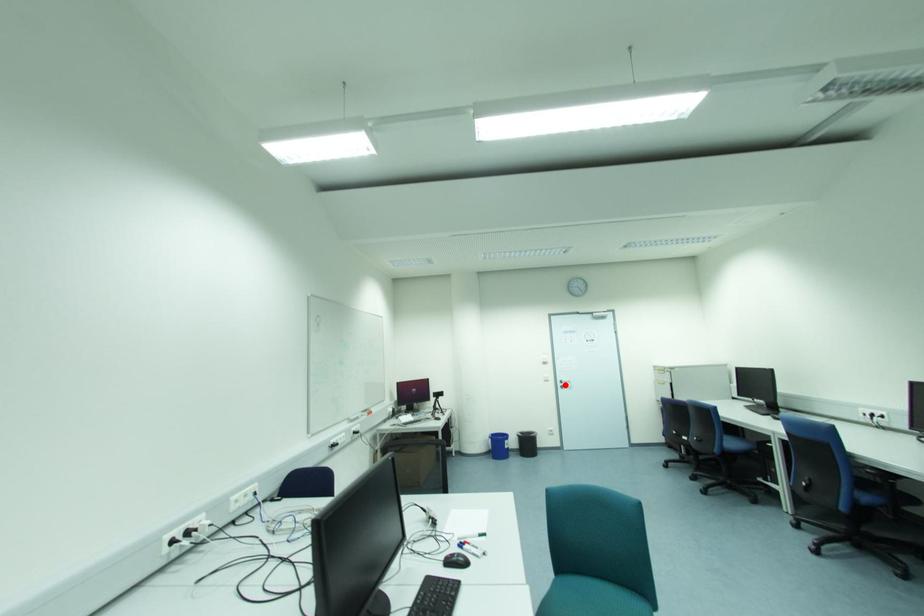
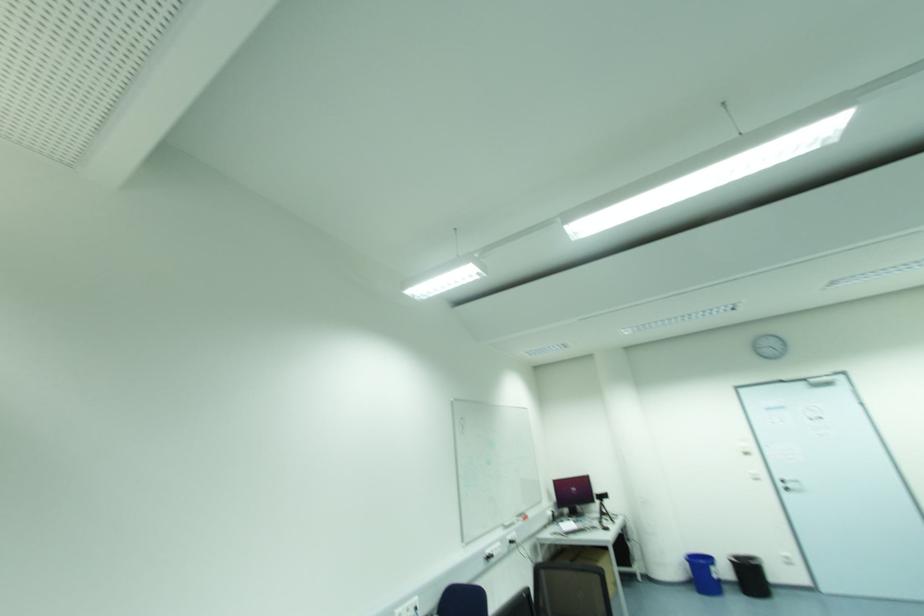
Where in the second image is the point corresponding to the highlighted location from the first image?

(789, 485)